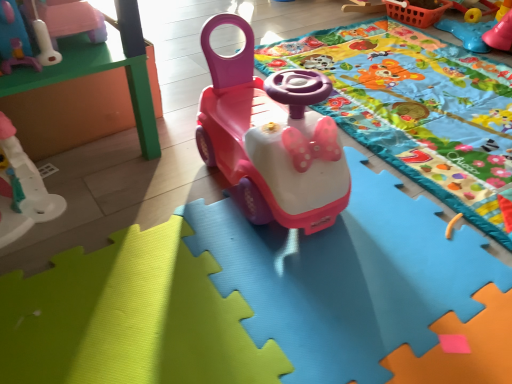
Question: Can you confirm if matte pink toy at upper left, which is the third toy from right to left, is shorter than orange plastic basket at upper right?

Choices:
 (A) yes
 (B) no

Answer: (B)

Question: Does matte pink toy at upper left, acting as the 2th toy starting from the left, come behind orange plastic basket at upper right?

Choices:
 (A) no
 (B) yes

Answer: (A)

Question: From the image's perspective, does matte pink toy at upper left, acting as the 2th toy starting from the left, appear lower than orange plastic basket at upper right?

Choices:
 (A) no
 (B) yes

Answer: (B)

Question: Is matte pink toy at upper left, acting as the 2th toy starting from the left, bigger than orange plastic basket at upper right?

Choices:
 (A) yes
 (B) no

Answer: (B)

Question: Could you tell me if matte pink toy at upper left, acting as the 2th toy starting from the left, is facing orange plastic basket at upper right?

Choices:
 (A) yes
 (B) no

Answer: (A)

Question: Is matte pink toy at upper left, which is the third toy from right to left, positioned far away from orange plastic basket at upper right?

Choices:
 (A) yes
 (B) no

Answer: (A)

Question: Is white plastic toy at left, which is the 1th toy from left to right, further to camera compared to orange plastic basket at upper right?

Choices:
 (A) no
 (B) yes

Answer: (A)

Question: Considering the relative sizes of white plastic toy at left, which is the fourth toy in right-to-left order, and orange plastic basket at upper right in the image provided, is white plastic toy at left, which is the fourth toy in right-to-left order, bigger than orange plastic basket at upper right?

Choices:
 (A) no
 (B) yes

Answer: (B)

Question: Considering the relative positions of white plastic toy at left, which is the fourth toy in right-to-left order, and orange plastic basket at upper right in the image provided, is white plastic toy at left, which is the fourth toy in right-to-left order, in front of orange plastic basket at upper right?

Choices:
 (A) no
 (B) yes

Answer: (B)

Question: Is white plastic toy at left, which is the fourth toy in right-to-left order, surrounding orange plastic basket at upper right?

Choices:
 (A) yes
 (B) no

Answer: (B)

Question: Can you confirm if white plastic toy at left, which is the fourth toy in right-to-left order, is wider than orange plastic basket at upper right?

Choices:
 (A) no
 (B) yes

Answer: (B)

Question: Can you confirm if rubberized blue steering wheel at upper right, the first toy viewed from the right, is smaller than matte plastic car at center, placed as the 3th toy when sorted from left to right?

Choices:
 (A) yes
 (B) no

Answer: (A)